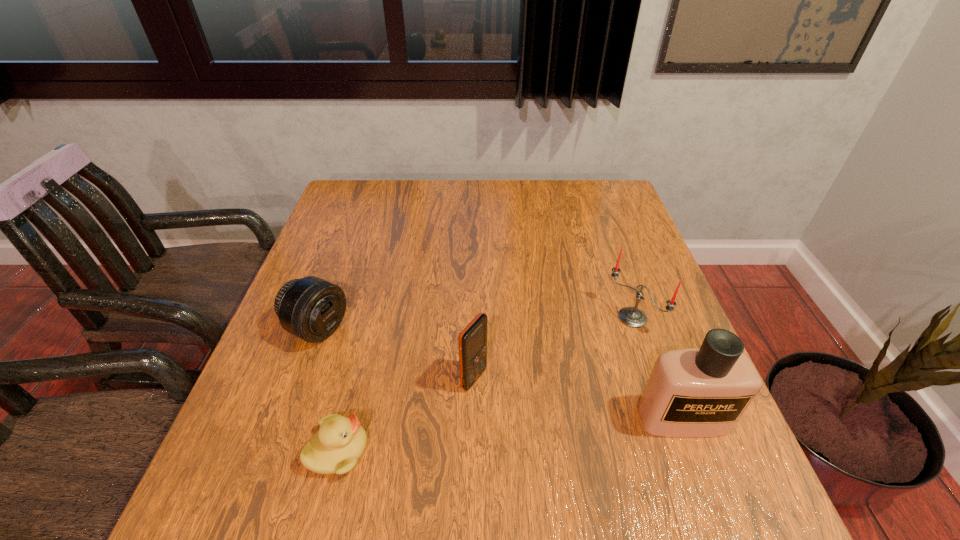
Locate an element on the screen. Image resolution: width=960 pixels, height=540 pixels. free space located on the front-facing side of the candle is located at coordinates (539, 401).

You are a GUI agent. You are given a task and a screenshot of the screen. Output one action in this format:
    pyautogui.click(x=<x>, y=<y>)
    Task: Click on the free space located 0.230m on the front-facing side of the candle
    The width and height of the screenshot is (960, 540).
    Given the screenshot: What is the action you would take?
    pyautogui.click(x=552, y=389)

This screenshot has width=960, height=540. I want to click on vacant space located 0.070m on the front-facing side of the candle, so pyautogui.click(x=600, y=348).

Identify the location of free location located 0.070m on the screen of the third object from right to left. This screenshot has height=540, width=960. (515, 404).

Identify the location of free space located 0.160m on the screen of the third object from right to left. (556, 427).

I want to click on free region located 0.070m on the screen of the third object from right to left, so click(x=515, y=404).

Where is `duckling that is at the near edge`? The image size is (960, 540). duckling that is at the near edge is located at coordinates (335, 448).

Find the location of a particular element. perfume that is positioned at the near edge is located at coordinates (694, 392).

This screenshot has height=540, width=960. I want to click on duckling that is at the left edge, so click(335, 448).

At what (x,y) coordinates should I click in order to perform the action: click on telephoto lens located at the left edge. Please return your answer as a coordinate pair (x, y). The width and height of the screenshot is (960, 540). Looking at the image, I should click on click(310, 308).